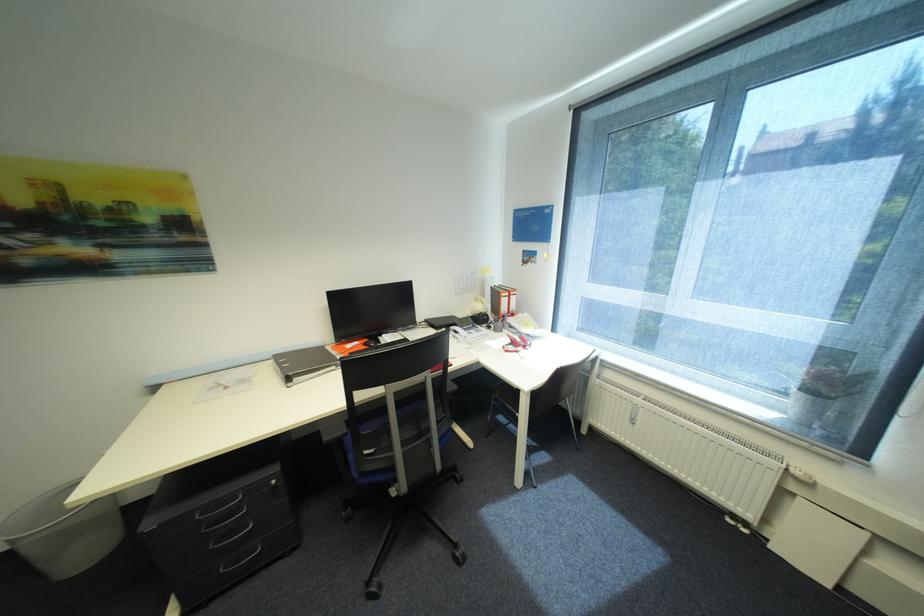
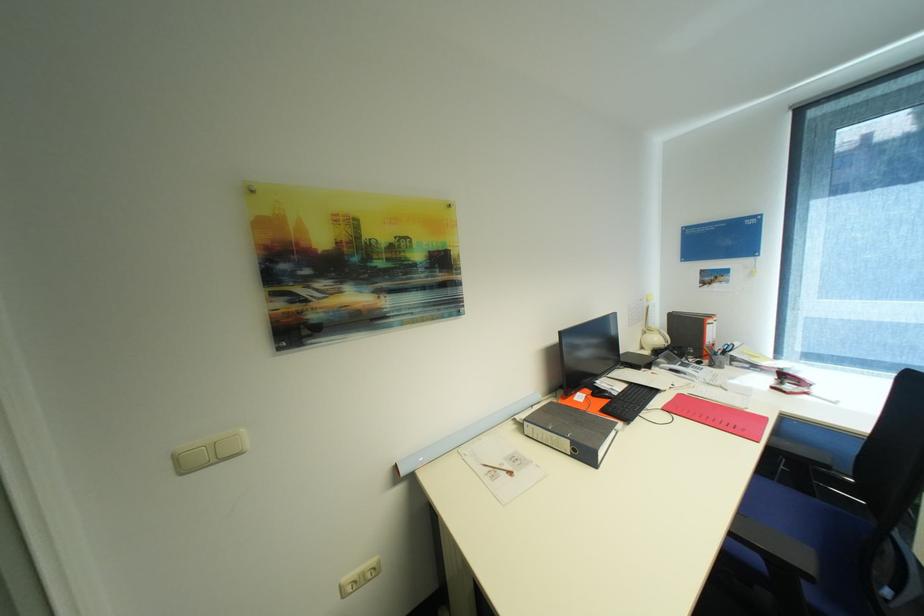
Where in the second image is the point corresponding to [525,352] from the first image?

(813, 394)